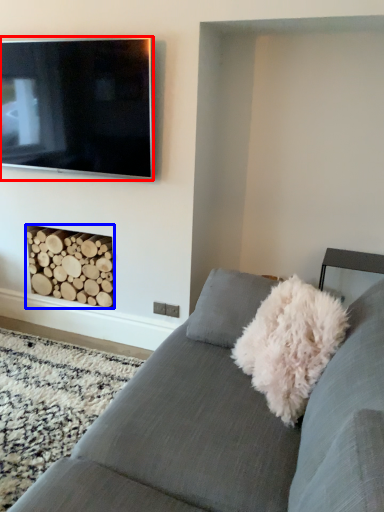
Question: Which of the following is the closest to the observer, television (highlighted by a red box) or fireplace (highlighted by a blue box)?

Choices:
 (A) television
 (B) fireplace

Answer: (A)